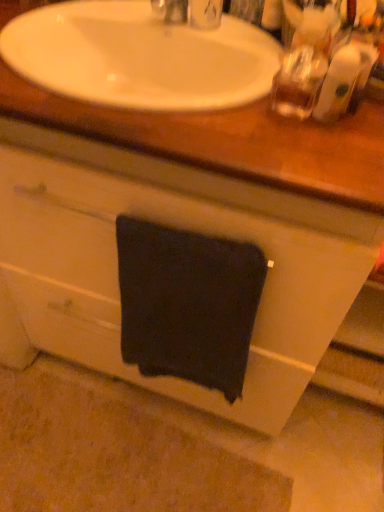
Question: Does dark fabric towel at center appear on the right side of white glossy sink at upper center?

Choices:
 (A) no
 (B) yes

Answer: (B)

Question: Can you confirm if dark fabric towel at center is positioned to the left of white glossy sink at upper center?

Choices:
 (A) yes
 (B) no

Answer: (B)

Question: Could white glossy sink at upper center be considered to be inside dark fabric towel at center?

Choices:
 (A) yes
 (B) no

Answer: (B)

Question: Is white glossy sink at upper center at the back of dark fabric towel at center?

Choices:
 (A) no
 (B) yes

Answer: (A)

Question: Is dark fabric towel at center aimed at white glossy sink at upper center?

Choices:
 (A) yes
 (B) no

Answer: (B)

Question: Does dark fabric towel at center have a greater height compared to white glossy sink at upper center?

Choices:
 (A) yes
 (B) no

Answer: (A)

Question: Is white glossy sink at upper center completely or partially outside of dark fabric towel at center?

Choices:
 (A) no
 (B) yes

Answer: (B)

Question: Considering the relative sizes of white glossy sink at upper center and dark fabric towel at center in the image provided, is white glossy sink at upper center thinner than dark fabric towel at center?

Choices:
 (A) yes
 (B) no

Answer: (B)

Question: Is white glossy sink at upper center positioned behind dark fabric towel at center?

Choices:
 (A) no
 (B) yes

Answer: (A)

Question: Are white glossy sink at upper center and dark fabric towel at center far apart?

Choices:
 (A) no
 (B) yes

Answer: (A)

Question: Is white glossy sink at upper center shorter than dark fabric towel at center?

Choices:
 (A) no
 (B) yes

Answer: (B)

Question: From the image's perspective, would you say white glossy sink at upper center is positioned over dark fabric towel at center?

Choices:
 (A) no
 (B) yes

Answer: (B)

Question: From a real-world perspective, is white glossy sink at upper center positioned above or below dark fabric towel at center?

Choices:
 (A) above
 (B) below

Answer: (A)